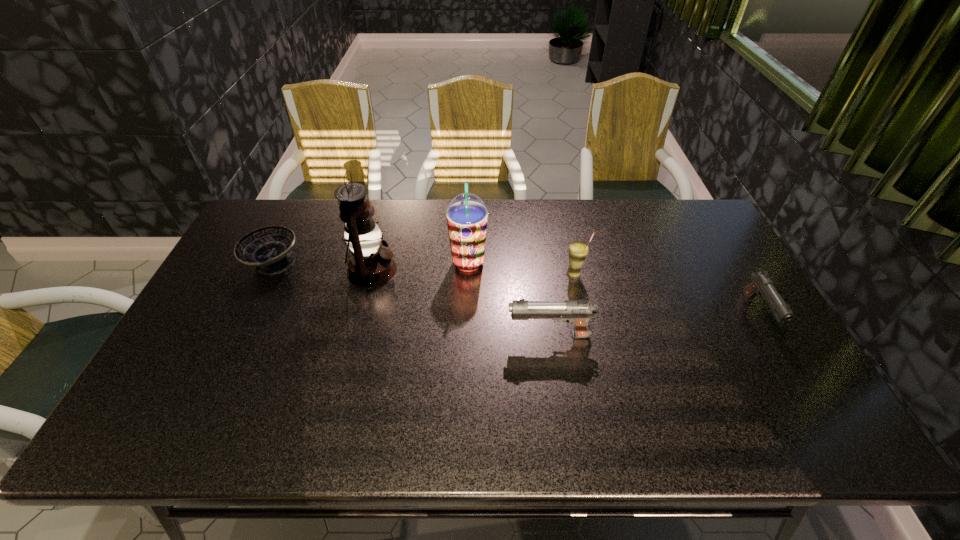
In order to click on object located in the right edge section of the desktop in this screenshot , I will do `click(762, 285)`.

In the image, there is a desktop. Find the location of `vacant area at the far edge`. vacant area at the far edge is located at coordinates (571, 203).

This screenshot has height=540, width=960. In the image, there is a desktop. Find the location of `vacant space at the left edge`. vacant space at the left edge is located at coordinates (206, 335).

At what (x,y) coordinates should I click in order to perform the action: click on vacant space at the right edge. Please return your answer as a coordinate pair (x, y). Looking at the image, I should click on (739, 337).

The height and width of the screenshot is (540, 960). What are the coordinates of `vacant region at the far left corner of the desktop` in the screenshot? It's located at (271, 225).

Image resolution: width=960 pixels, height=540 pixels. What are the coordinates of `vacant position at the far right corner of the desktop` in the screenshot? It's located at (689, 203).

Find the location of `blank region between the right gun and the third object from left to right`. blank region between the right gun and the third object from left to right is located at coordinates (613, 289).

Find the location of a particular element. The image size is (960, 540). vacant area that lies between the left gun and the smoothie is located at coordinates (509, 299).

Locate an element on the screen. free space between the fourth shortest object and the lantern is located at coordinates (473, 272).

This screenshot has height=540, width=960. Identify the location of free space between the right gun and the straw for drinking. (666, 294).